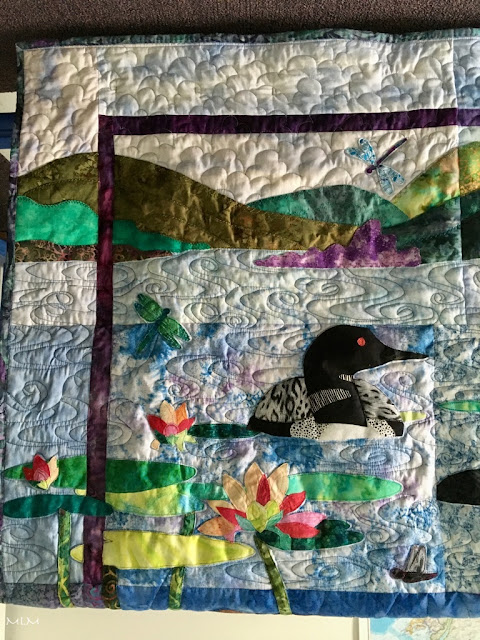
What are the coordinates of `yellow wall under right and center area of quilt` in the screenshot? It's located at (120, 628), (250, 634).